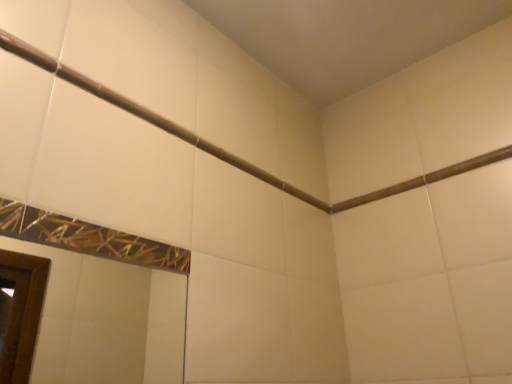
What do you see at coordinates (148, 115) in the screenshot? I see `matte white shower at upper left` at bounding box center [148, 115].

Where is `matte white shower at upper left`? matte white shower at upper left is located at coordinates (148, 115).

In the scene shown: In order to face matte white shower at upper left, should I rotate leftwards or rightwards?

A 4.723 degree turn to the left will do.

What do you see at coordinates (425, 179) in the screenshot?
I see `brown matte beam at upper center` at bounding box center [425, 179].

What is the approximate height of brown matte beam at upper center?

It is 1.44 inches.

Based on the photo, what is the approximate width of brown matte beam at upper center?

brown matte beam at upper center is 0.60 inches in width.

The width and height of the screenshot is (512, 384). Find the location of `brown matte beam at upper center`. brown matte beam at upper center is located at coordinates (425, 179).

You are a GUI agent. You are given a task and a screenshot of the screen. Output one action in this format:
    pyautogui.click(x=<x>, y=<y>)
    Task: Click on the matte white shower at upper left
    
    Given the screenshot: What is the action you would take?
    pyautogui.click(x=148, y=115)

Between matte white shower at upper left and brown matte beam at upper center, which one appears on the right side from the viewer's perspective?

brown matte beam at upper center is more to the right.

Is the position of matte white shower at upper left less distant than that of brown matte beam at upper center?

Yes, it is.

Which is in front, point (120, 103) or point (458, 170)?

The point (120, 103) is closer.

From the image's perspective, does matte white shower at upper left appear lower than brown matte beam at upper center?

Actually, matte white shower at upper left appears above brown matte beam at upper center in the image.

From a real-world perspective, which object rests below the other?

matte white shower at upper left, from a real-world perspective.

Considering the relative sizes of matte white shower at upper left and brown matte beam at upper center in the image provided, is matte white shower at upper left wider than brown matte beam at upper center?

Indeed, matte white shower at upper left has a greater width compared to brown matte beam at upper center.

Which of these two, matte white shower at upper left or brown matte beam at upper center, stands taller?

With more height is matte white shower at upper left.

Does matte white shower at upper left have a smaller size compared to brown matte beam at upper center?

Incorrect, matte white shower at upper left is not smaller in size than brown matte beam at upper center.

Would you say matte white shower at upper left is inside or outside brown matte beam at upper center?

matte white shower at upper left is spatially situated outside brown matte beam at upper center.

Is matte white shower at upper left positioned far away from brown matte beam at upper center?

No, matte white shower at upper left is not far away from brown matte beam at upper center.

Is matte white shower at upper left looking in the opposite direction of brown matte beam at upper center?

That's not correct — matte white shower at upper left is not looking away from brown matte beam at upper center.

From the picture: How many degrees apart are the facing directions of matte white shower at upper left and brown matte beam at upper center?

matte white shower at upper left and brown matte beam at upper center are facing 91.1 degrees away from each other.

The height and width of the screenshot is (384, 512). What are the coordinates of `shower that is in front of the brown matte beam at upper center` in the screenshot? It's located at (148, 115).

Is brown matte beam at upper center to the left or to the right of matte white shower at upper left in the image?

brown matte beam at upper center is positioned on matte white shower at upper left's right side.

Is brown matte beam at upper center behind matte white shower at upper left?

Yes, brown matte beam at upper center is further from the viewer.

Is point (469, 164) closer or farther from the camera than point (295, 192)?

Point (469, 164) is closer to the camera than point (295, 192).

From the image's perspective, is brown matte beam at upper center positioned above or below matte white shower at upper left?

From the image's perspective, brown matte beam at upper center appears below matte white shower at upper left.

From a real-world perspective, is brown matte beam at upper center located beneath matte white shower at upper left?

No, from a real-world perspective, brown matte beam at upper center is not under matte white shower at upper left.

Considering the sizes of objects brown matte beam at upper center and matte white shower at upper left in the image provided, who is wider, brown matte beam at upper center or matte white shower at upper left?

matte white shower at upper left is wider.

Is brown matte beam at upper center taller than matte white shower at upper left?

No.

Considering the relative sizes of brown matte beam at upper center and matte white shower at upper left in the image provided, is brown matte beam at upper center bigger than matte white shower at upper left?

No.

Is brown matte beam at upper center positioned beyond the bounds of matte white shower at upper left?

Absolutely, brown matte beam at upper center is external to matte white shower at upper left.

Is brown matte beam at upper center directly adjacent to matte white shower at upper left?

No, brown matte beam at upper center is not making contact with matte white shower at upper left.

Does brown matte beam at upper center turn towards matte white shower at upper left?

Yes, brown matte beam at upper center is aimed at matte white shower at upper left.

What's the angular difference between brown matte beam at upper center and matte white shower at upper left's facing directions?

The angle between the facing direction of brown matte beam at upper center and the facing direction of matte white shower at upper left is 91.1 degrees.

Locate an element on the screen. The height and width of the screenshot is (384, 512). shower in front of the brown matte beam at upper center is located at coordinates (148, 115).

Locate an element on the screen. Image resolution: width=512 pixels, height=384 pixels. shower below the brown matte beam at upper center (from a real-world perspective) is located at coordinates (148, 115).

The height and width of the screenshot is (384, 512). What are the coordinates of `beam behind the matte white shower at upper left` in the screenshot? It's located at (425, 179).